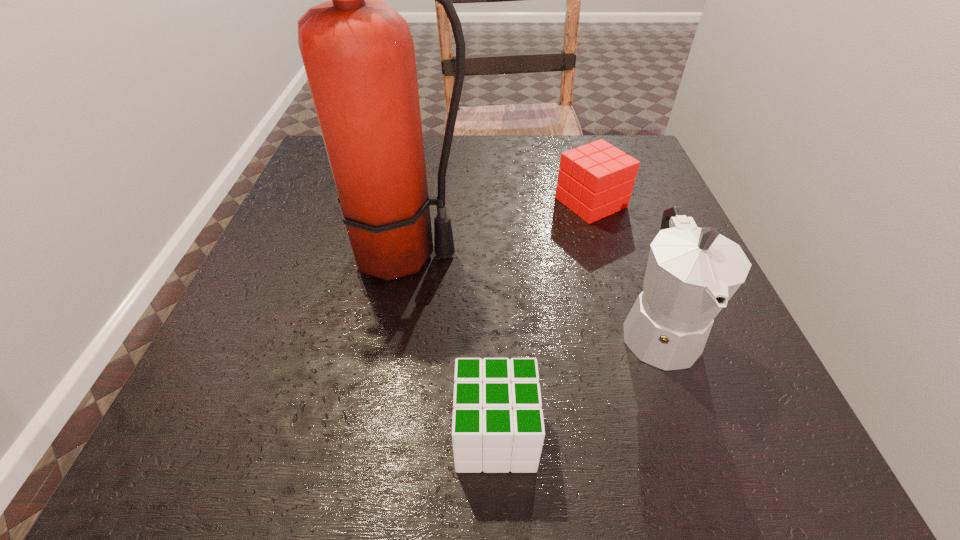
Find the location of a particular element. This screenshot has width=960, height=540. free spot between the coffeepot and the farthest object is located at coordinates (624, 266).

Identify the location of free spot between the farthest object and the nearer cube. (543, 319).

Locate an element on the screen. free spot between the fire extinguisher and the nearest object is located at coordinates (449, 345).

What are the coordinates of `object identified as the second closest to the farther cube` in the screenshot? It's located at (358, 53).

Identify which object is the closest to the nearest object. Please provide its 2D coordinates. Your answer should be formatted as a tuple, i.e. [(x, y)], where the tuple contains the x and y coordinates of a point satisfying the conditions above.

[(691, 274)]

Locate an element on the screen. vacant point that satisfies the following two spatial constraints: 1. at the spout of the second tallest object; 2. on the red face of the nearer cube is located at coordinates (696, 434).

Where is `free space that satisfies the following two spatial constraints: 1. at the spout of the second tallest object; 2. on the red face of the nearest object`? This screenshot has width=960, height=540. free space that satisfies the following two spatial constraints: 1. at the spout of the second tallest object; 2. on the red face of the nearest object is located at coordinates (696, 434).

Identify the location of free spot that satisfies the following two spatial constraints: 1. at the spout of the coffeepot; 2. on the red face of the left cube. (696, 434).